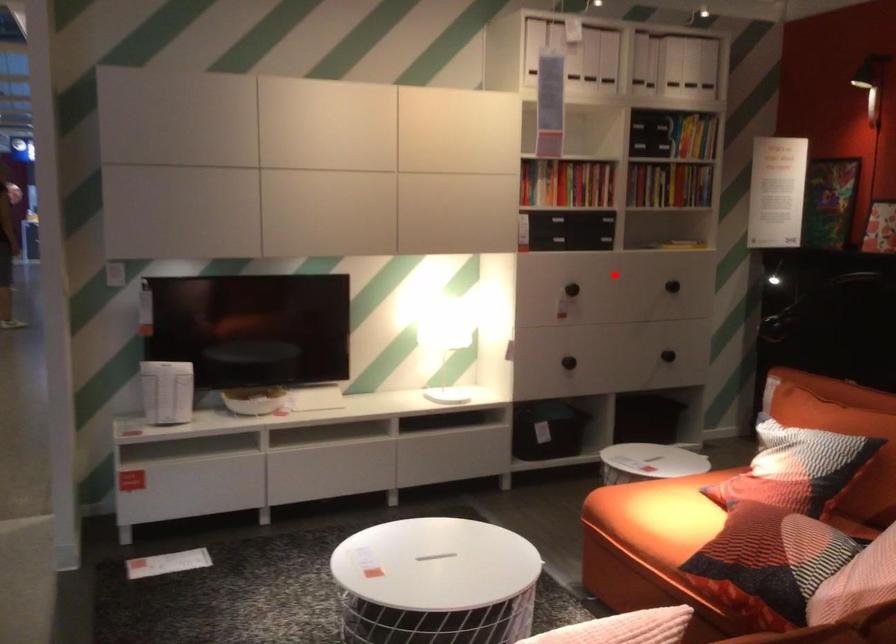
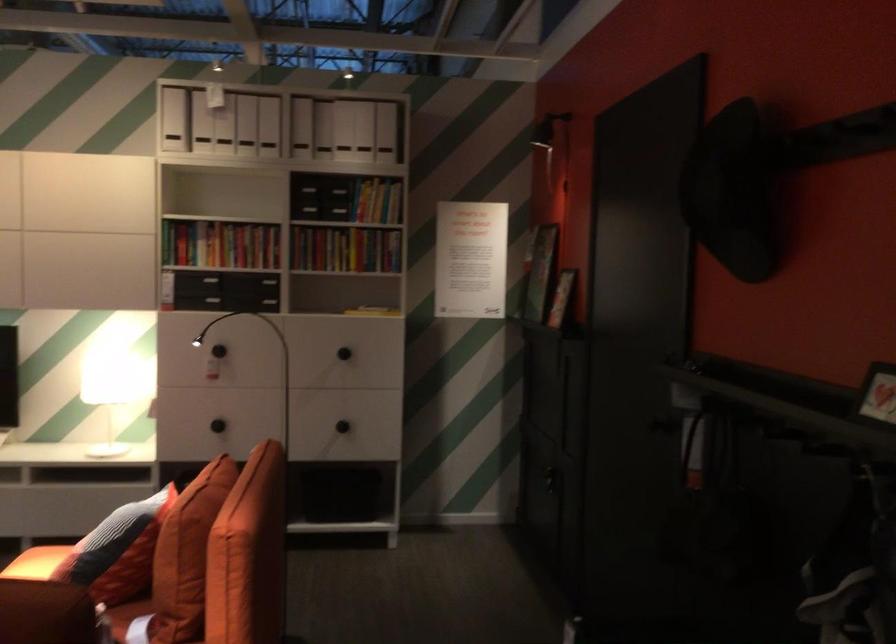
The point at the highlighted location is marked in the first image. Where is the corresponding point in the second image?

(218, 351)